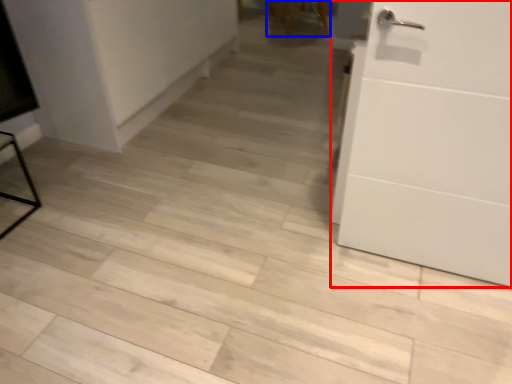
Question: Which object is closer to the camera taking this photo, door (highlighted by a red box) or chair (highlighted by a blue box)?

Choices:
 (A) door
 (B) chair

Answer: (A)